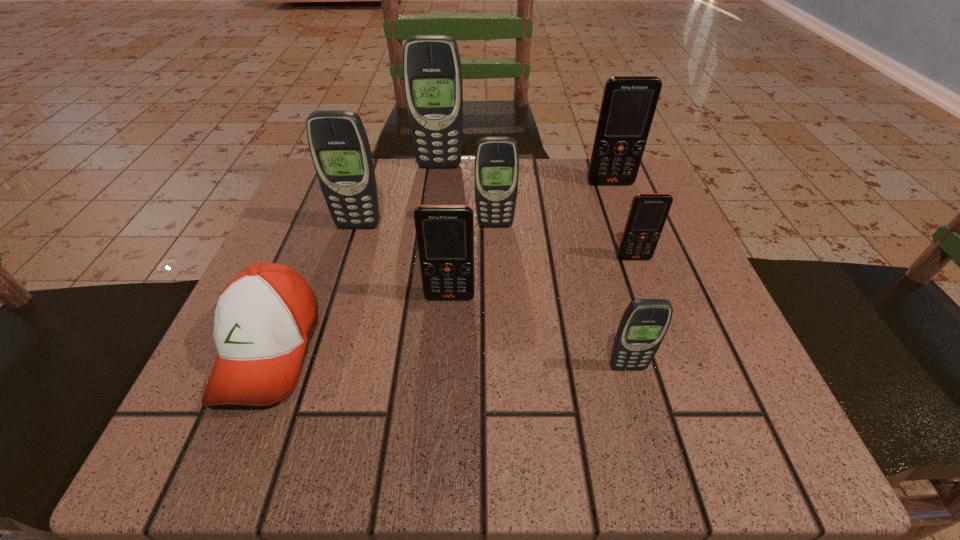
Find the location of a particular element. The width and height of the screenshot is (960, 540). unoccupied area between the nearest cellular telephone and the farthest object is located at coordinates (534, 266).

I want to click on object identified as the closest to the farthest gray cellular telephone, so click(496, 170).

Locate which object is the closest to the farthest gray cellular telephone. Please provide its 2D coordinates. Your answer should be formatted as a tuple, i.e. [(x, y)], where the tuple contains the x and y coordinates of a point satisfying the conditions above.

[(496, 170)]

Identify which cellular telephone is the third nearest to the orange baseball cap. Please provide its 2D coordinates. Your answer should be formatted as a tuple, i.e. [(x, y)], where the tuple contains the x and y coordinates of a point satisfying the conditions above.

[(496, 170)]

Identify which cellular telephone is the closest to the orange baseball cap. Please provide its 2D coordinates. Your answer should be formatted as a tuple, i.e. [(x, y)], where the tuple contains the x and y coordinates of a point satisfying the conditions above.

[(445, 233)]

Identify which gray cellular telephone is the third nearest to the orange baseball cap. Please provide its 2D coordinates. Your answer should be formatted as a tuple, i.e. [(x, y)], where the tuple contains the x and y coordinates of a point satisfying the conditions above.

[(432, 73)]

Identify which gray cellular telephone is located as the second nearest to the sixth nearest cellular telephone. Please provide its 2D coordinates. Your answer should be formatted as a tuple, i.e. [(x, y)], where the tuple contains the x and y coordinates of a point satisfying the conditions above.

[(432, 73)]

Locate an element on the screen. The height and width of the screenshot is (540, 960). orange cellular telephone that stands as the second closest to the third gray cellular telephone from left to right is located at coordinates coord(648,212).

Identify which orange cellular telephone is the second nearest to the second smallest gray cellular telephone. Please provide its 2D coordinates. Your answer should be formatted as a tuple, i.e. [(x, y)], where the tuple contains the x and y coordinates of a point satisfying the conditions above.

[(648, 212)]